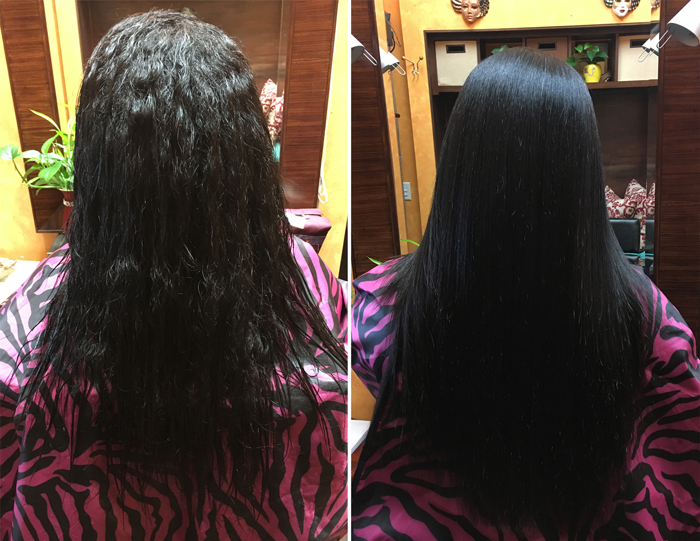
At what (x,y) coordinates should I click in order to perform the action: click on pillows. Please return your answer as a coordinate pair (x, y). The width and height of the screenshot is (700, 541). Looking at the image, I should click on (626, 210), (643, 206).